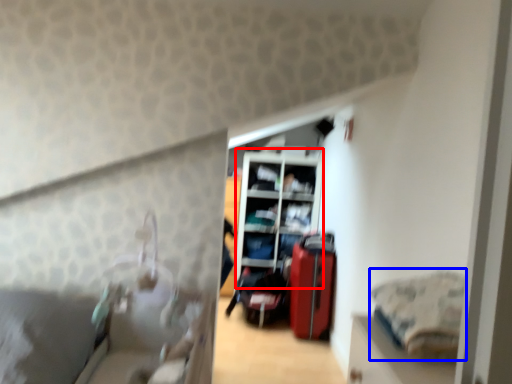
Question: Which point is closer to the camera, locker (highlighted by a red box) or bedding (highlighted by a blue box)?

Choices:
 (A) locker
 (B) bedding

Answer: (B)